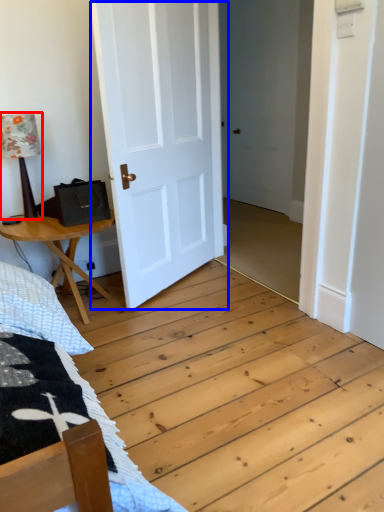
Question: Which point is further to the camera, table lamp (highlighted by a red box) or door (highlighted by a blue box)?

Choices:
 (A) table lamp
 (B) door

Answer: (A)